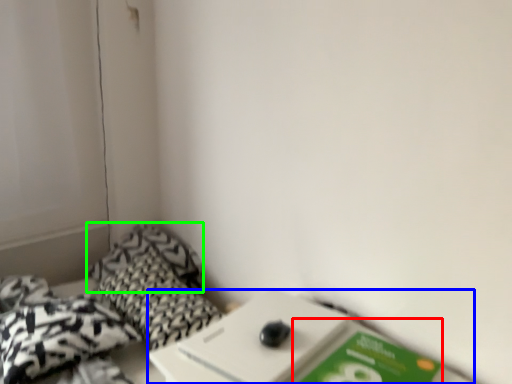
Question: Which is farther away from paperback book (highlighted by a red box)? table (highlighted by a blue box) or pillow (highlighted by a green box)?

Choices:
 (A) table
 (B) pillow

Answer: (B)